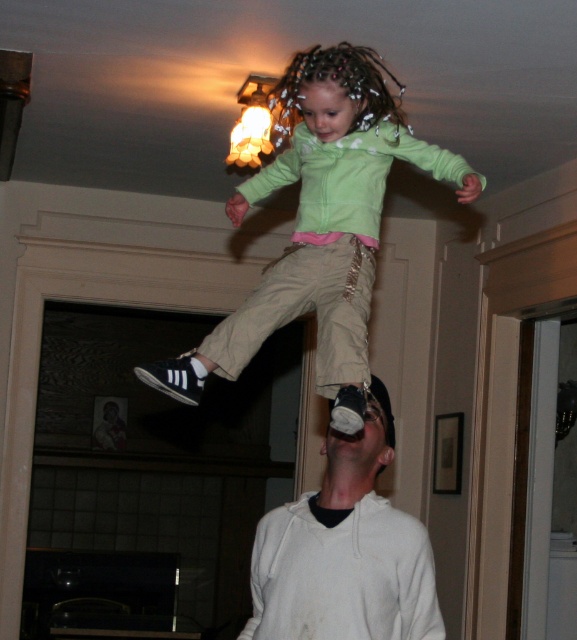
Question: Which of the following is the closest to the observer?

Choices:
 (A) white cotton hoodie at lower center
 (B) green matte hoodie at upper center

Answer: (A)

Question: Does green matte hoodie at upper center appear under white cotton hoodie at lower center?

Choices:
 (A) no
 (B) yes

Answer: (A)

Question: Which point is closer to the camera?

Choices:
 (A) green matte hoodie at upper center
 (B) white cotton hoodie at lower center

Answer: (B)

Question: Which object appears farthest from the camera in this image?

Choices:
 (A) green matte hoodie at upper center
 (B) white cotton hoodie at lower center

Answer: (A)

Question: Is green matte hoodie at upper center to the right of white cotton hoodie at lower center from the viewer's perspective?

Choices:
 (A) yes
 (B) no

Answer: (B)

Question: Can you confirm if green matte hoodie at upper center is thinner than white cotton hoodie at lower center?

Choices:
 (A) no
 (B) yes

Answer: (A)